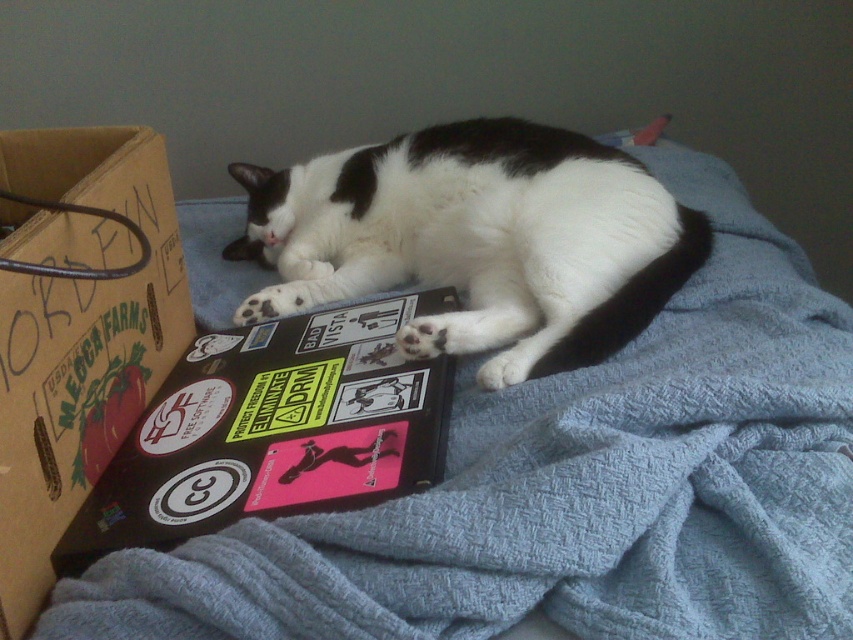
You are a delivery person who needs to place a package on the desk where the black and white fur cat at center and the cardboard box at left are located. The package is 12 inches wide. Can you fit the package between the cat and the box without moving them?

The black and white fur cat at center is 10.26 inches from the cardboard box at left, so the package which is 12 inches wide cannot fit between them since the distance is smaller than the package width.

You are holding a laser pointer and want to shine it on the point at coordinates point (175, 282). The laser pointer has a range of 30 inches. Can you reach the point with the laser pointer?

The point point (175, 282) is 31.46 inches from the viewer, which is beyond the laser pointer range of 30 inches. Therefore, you cannot reach the point with the laser pointer.

You are a photographer trying to capture the black and white fur cat at center in the image. If the cat is at coordinates point 0.377, 0.560, what is the cat position relative to the center of the image?

The cat is positioned slightly to the left and below the center of the image since its coordinates are (x=477, y=241).